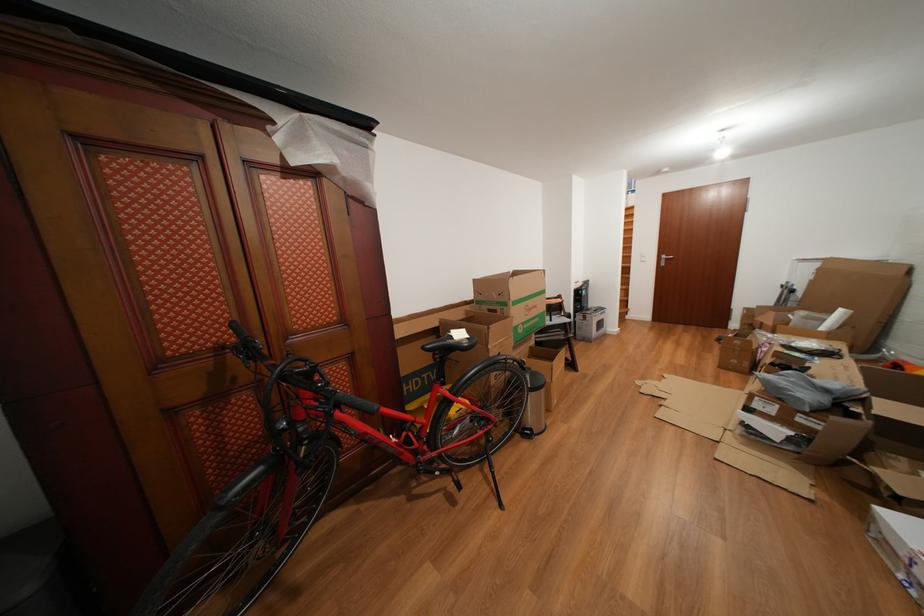
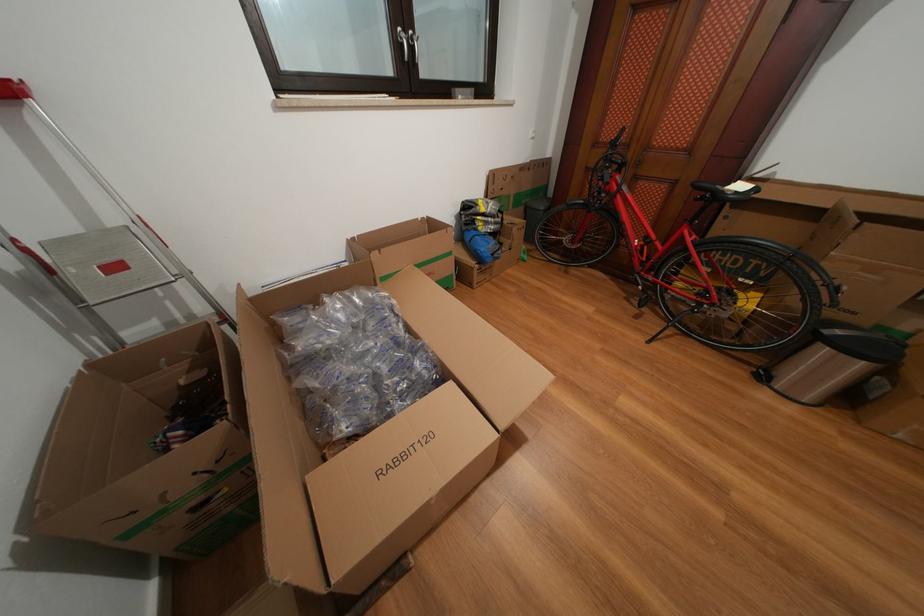
Where in the second image is the point corresponding to point (468, 339) from the first image?

(747, 192)